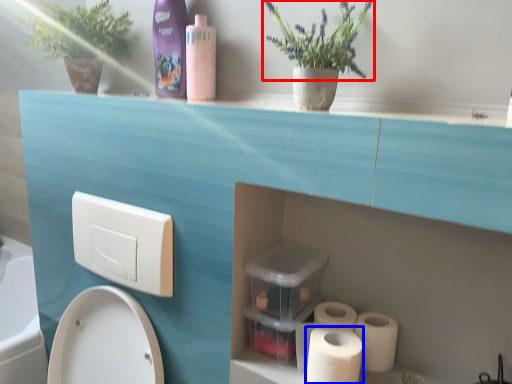
Question: Among these objects, which one is farthest to the camera, flower (highlighted by a red box) or toilet paper (highlighted by a blue box)?

Choices:
 (A) flower
 (B) toilet paper

Answer: (B)